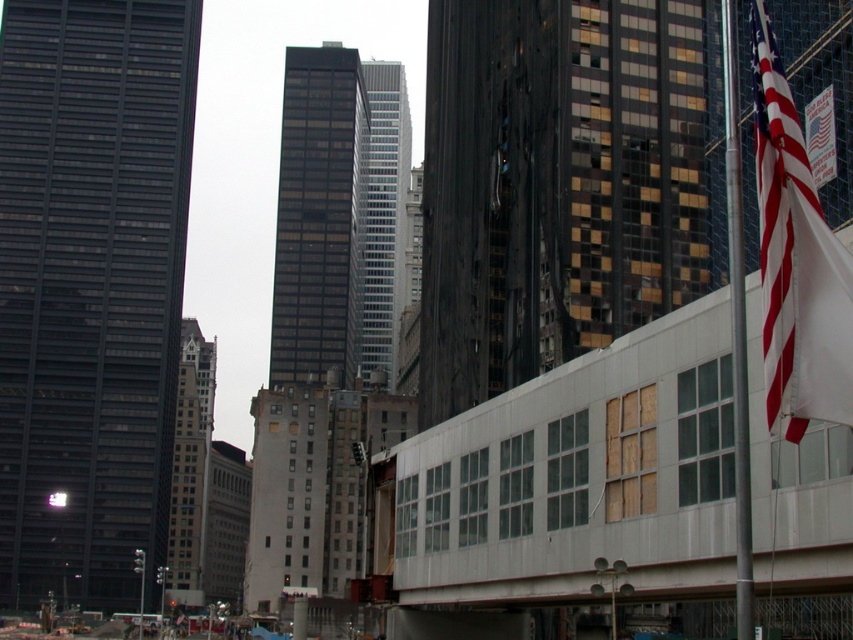
Question: Does red-white striped flag at right appear on the left side of silver metallic pole at right?

Choices:
 (A) yes
 (B) no

Answer: (A)

Question: Which point is closer to the camera taking this photo?

Choices:
 (A) (740, 496)
 (B) (763, 216)

Answer: (B)

Question: Is red-white striped flag at right positioned in front of silver metallic pole at right?

Choices:
 (A) yes
 (B) no

Answer: (A)

Question: Which point is closer to the camera?

Choices:
 (A) red-white striped flag at right
 (B) silver metallic pole at right

Answer: (A)

Question: Which of the following is the closest to the observer?

Choices:
 (A) red-white striped flag at right
 (B) silver metallic pole at right

Answer: (A)

Question: Does red-white striped flag at right have a larger size compared to silver metallic pole at right?

Choices:
 (A) yes
 (B) no

Answer: (B)